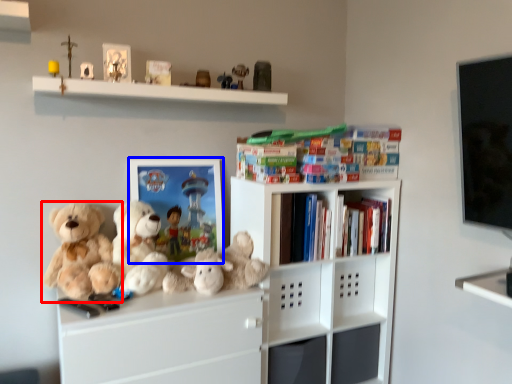
Question: Among these objects, which one is farthest to the camera, teddy bear (highlighted by a red box) or picture frame (highlighted by a blue box)?

Choices:
 (A) teddy bear
 (B) picture frame

Answer: (B)